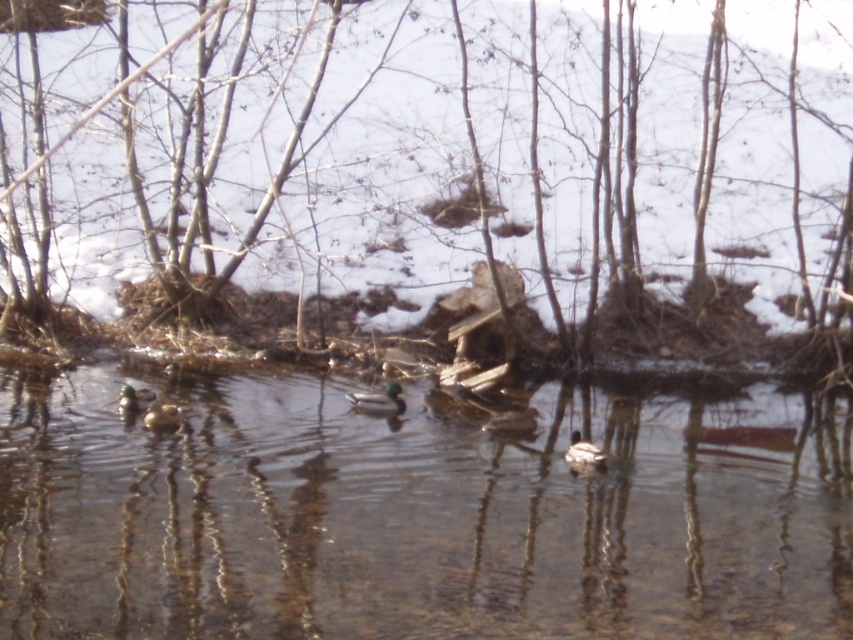
Does clear water at center come in front of green glossy duck at lower left?

Yes, it is in front of green glossy duck at lower left.

How much distance is there between clear water at center and green glossy duck at lower left?

A distance of 11.48 feet exists between clear water at center and green glossy duck at lower left.

Locate an element on the screen. The image size is (853, 640). clear water at center is located at coordinates (419, 516).

Locate an element on the screen. The width and height of the screenshot is (853, 640). brown wood at center is located at coordinates (457, 163).

Between brown wood at center and green matte duck at center, which one has less height?

With less height is green matte duck at center.

Is point (254, 243) closer to viewer compared to point (381, 396)?

No, (254, 243) is further to viewer.

I want to click on brown wood at center, so click(457, 163).

Which of these two, brown wood at center or white matte duck at center, stands shorter?

white matte duck at center

In the scene shown: Is brown wood at center positioned in front of white matte duck at center?

Yes, it is in front of white matte duck at center.

The height and width of the screenshot is (640, 853). What do you see at coordinates (457, 163) in the screenshot?
I see `brown wood at center` at bounding box center [457, 163].

Where is `brown wood at center`? The width and height of the screenshot is (853, 640). brown wood at center is located at coordinates (457, 163).